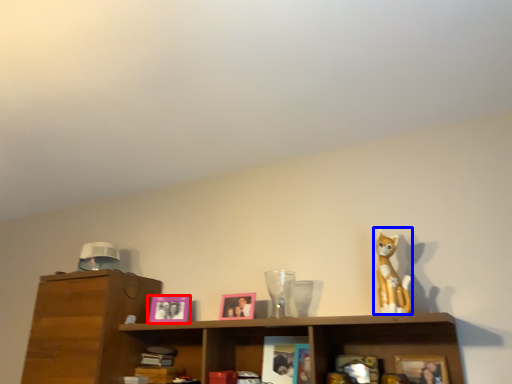
Question: Among these objects, which one is nearest to the camera, picture frame (highlighted by a red box) or toy (highlighted by a blue box)?

Choices:
 (A) picture frame
 (B) toy

Answer: (B)